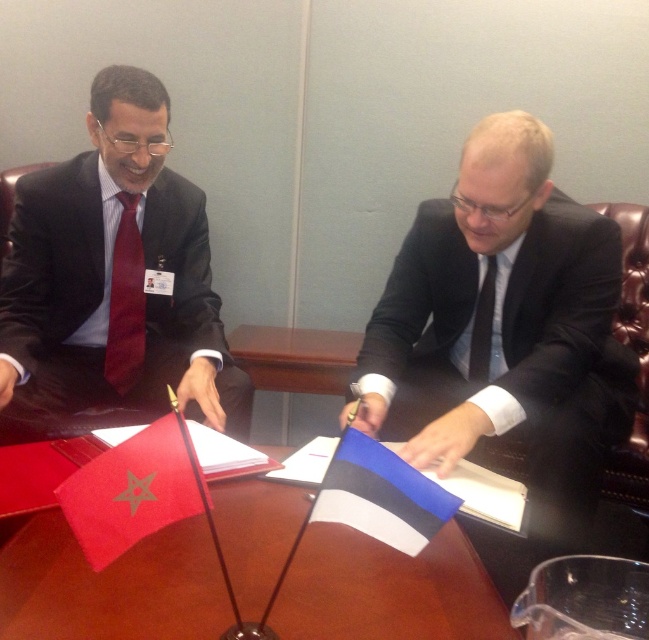
Consider the image. You are a photographer standing in front of the table. You want to take a photo of the matte black suit at center and the matte red tie at left. Which object will appear larger in your photo?

The matte black suit at center will appear larger in the photo because it is closer to the viewer than the matte red tie at left.

You are a photographer preparing to take a portrait of the two individuals at the table. You need to ensure that the matte black suit at left and the matte red tie at left are both clearly visible in the frame. Given their sizes, which object should you focus on to ensure both are in focus?

The matte black suit at left is bigger than the matte red tie at left, so focusing on the matte black suit at left will ensure both are in focus since it is larger and occupies more space in the frame.

You are a photographer setting up for a formal event. You need to arrange two subjects in a way that the matte black suit at center and the matte red tie at left are visible in the frame. Given their current positions, which subject should you move closer to the camera to ensure both are fully visible?

The matte red tie at left should be moved closer to the camera because the matte black suit at center is positioned under it, so moving the tie forward will allow both to be fully visible without obstruction.